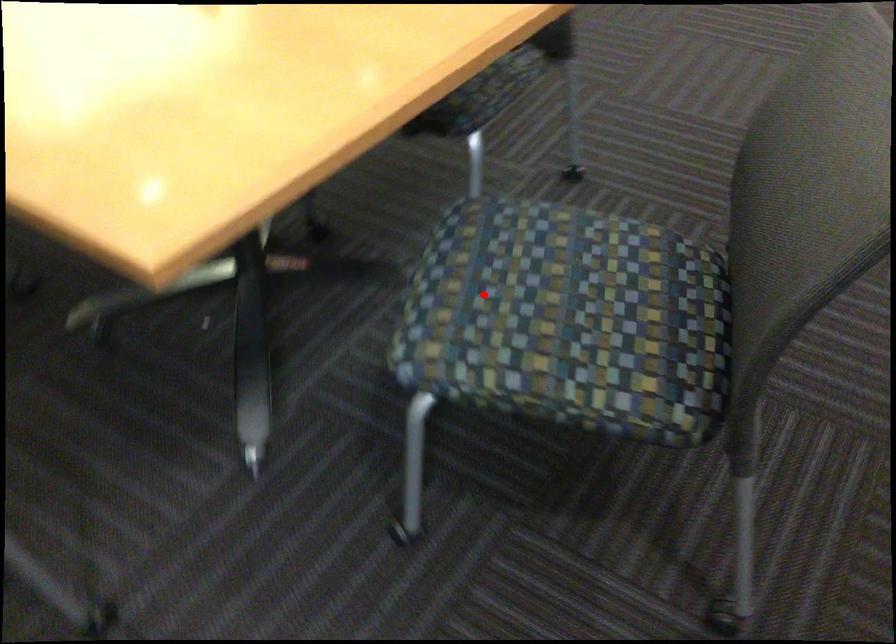
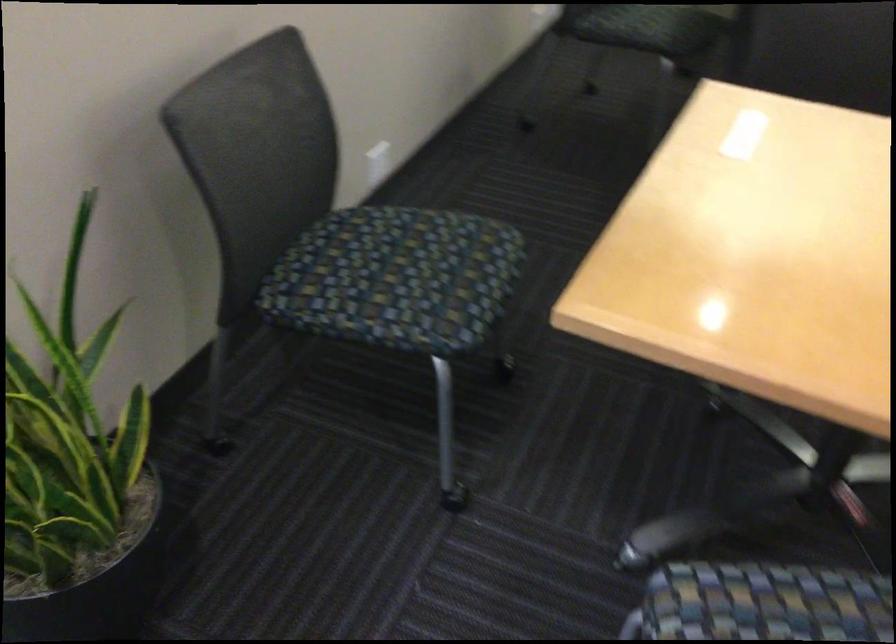
Find the pixel in the second image that matches the highlighted location in the first image.

(765, 603)